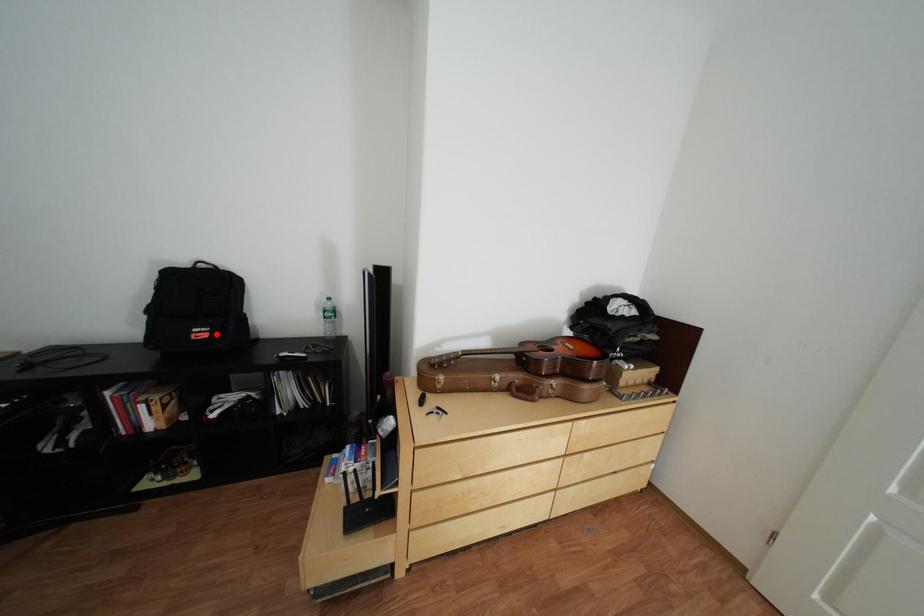
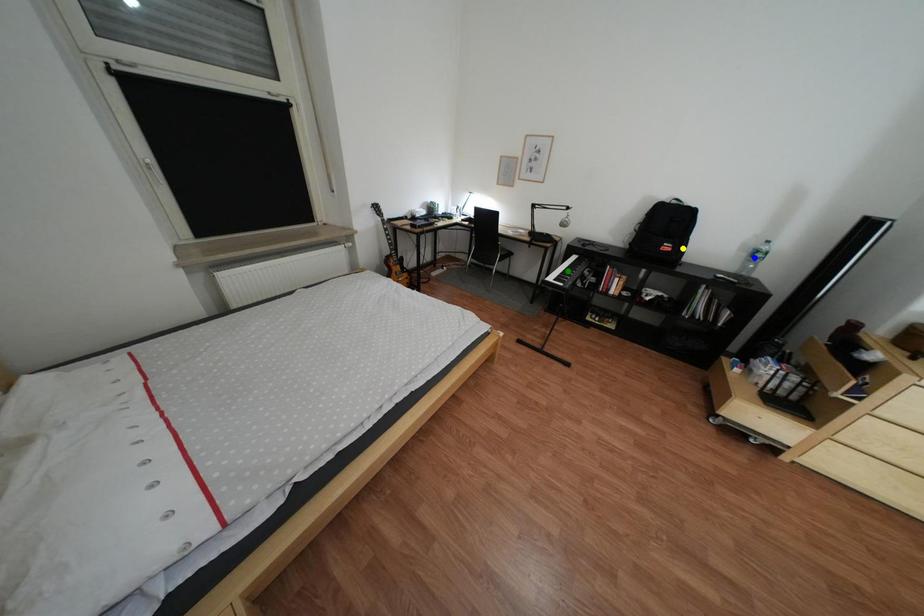
Question: I am providing you with two images of the same scene from different viewpoints. A red point is marked on the first image. You are given multiple points on the second image. Which point in image 2 is actually the same real-world point as the red point in image 1?

Choices:
 (A) yellow point
 (B) green point
 (C) blue point

Answer: (A)